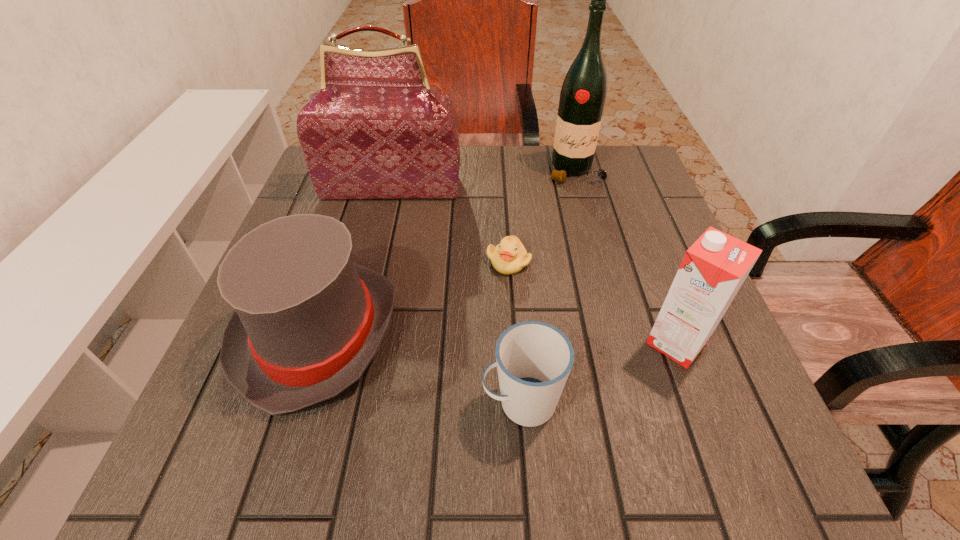
Where is `carton at the right edge`? carton at the right edge is located at coordinates (713, 269).

This screenshot has height=540, width=960. In order to click on object located in the far left corner section of the desktop in this screenshot , I will do `click(376, 130)`.

Image resolution: width=960 pixels, height=540 pixels. I want to click on object present at the far right corner, so click(582, 98).

You are a GUI agent. You are given a task and a screenshot of the screen. Output one action in this format:
    pyautogui.click(x=<x>, y=<y>)
    Task: Click on the vacant region at the far edge of the desktop
    The height and width of the screenshot is (540, 960).
    Given the screenshot: What is the action you would take?
    pyautogui.click(x=501, y=190)

Locate an element on the screen. Image resolution: width=960 pixels, height=540 pixels. free spot at the near edge of the desktop is located at coordinates (299, 457).

Where is `vacant space at the right edge of the desktop`? Image resolution: width=960 pixels, height=540 pixels. vacant space at the right edge of the desktop is located at coordinates (653, 278).

At what (x,y) coordinates should I click in order to perform the action: click on free spot at the near left corner of the desktop. Please return your answer as a coordinate pair (x, y). Looking at the image, I should click on (294, 430).

The image size is (960, 540). In the image, there is a desktop. Find the location of `vacant space at the far right corner`. vacant space at the far right corner is located at coordinates (585, 181).

Image resolution: width=960 pixels, height=540 pixels. Identify the location of empty space between the dress hat and the handbag. (355, 261).

The height and width of the screenshot is (540, 960). Identify the location of free point between the third tallest object and the fourth tallest object. (497, 338).